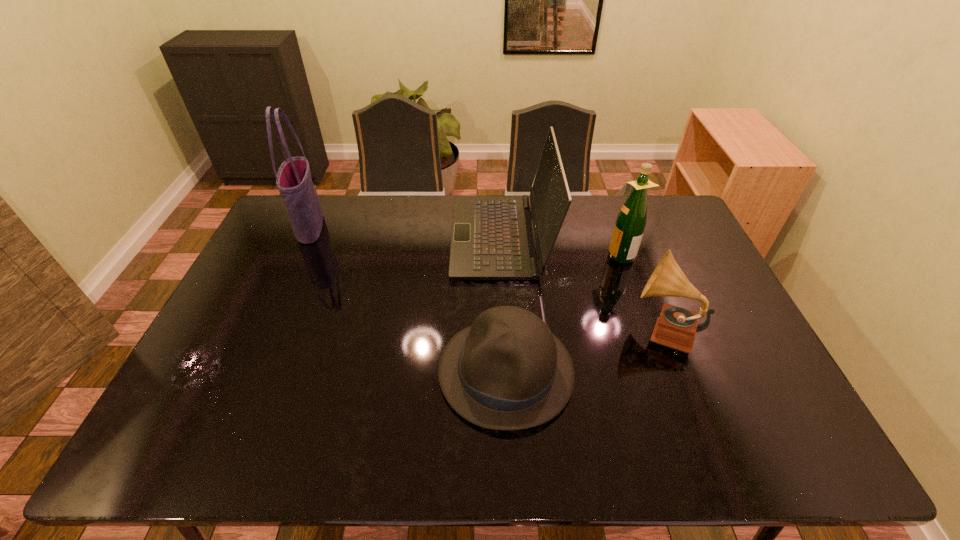
You are a GUI agent. You are given a task and a screenshot of the screen. Output one action in this format:
    pyautogui.click(x=<x>, y=<y>)
    Task: Click on the vacant region at the near right corner of the desktop
    This screenshot has height=540, width=960.
    Given the screenshot: What is the action you would take?
    pyautogui.click(x=761, y=456)

You are a GUI agent. You are given a task and a screenshot of the screen. Output one action in this format:
    pyautogui.click(x=<x>, y=<y>)
    Task: Click on the empty space between the bowler hat and the fourth tallest object
    
    Given the screenshot: What is the action you would take?
    pyautogui.click(x=584, y=350)

Locate an element on the screen. This screenshot has width=960, height=540. vacant point located between the laptop computer and the leftmost object is located at coordinates (406, 232).

Locate an element on the screen. The width and height of the screenshot is (960, 540). unoccupied area between the liquor and the laptop computer is located at coordinates (561, 246).

Locate an element on the screen. This screenshot has width=960, height=540. free point between the laptop computer and the second shortest object is located at coordinates (581, 284).

Locate an element on the screen. This screenshot has width=960, height=540. unoccupied position between the shortest object and the laptop computer is located at coordinates (504, 304).

This screenshot has width=960, height=540. I want to click on vacant area that lies between the shortest object and the liquor, so click(x=563, y=313).

This screenshot has width=960, height=540. In order to click on free area in between the second shortest object and the shortest object in this screenshot , I will do `click(584, 350)`.

Locate an element on the screen. This screenshot has height=540, width=960. free space between the laptop computer and the liquor is located at coordinates (561, 246).

Find the location of `unoccupied area between the liquor and the laptop computer`. unoccupied area between the liquor and the laptop computer is located at coordinates (561, 246).